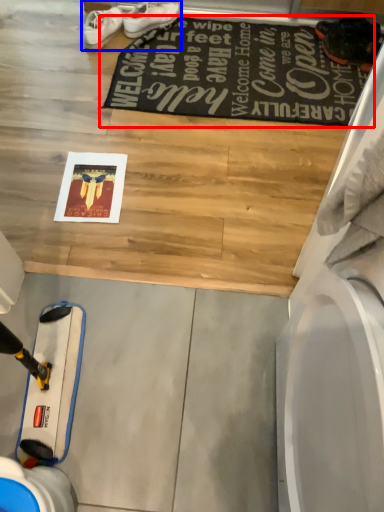
Question: Which of the following is the closest to the observer, mat (highlighted by a red box) or footwear (highlighted by a blue box)?

Choices:
 (A) mat
 (B) footwear

Answer: (A)